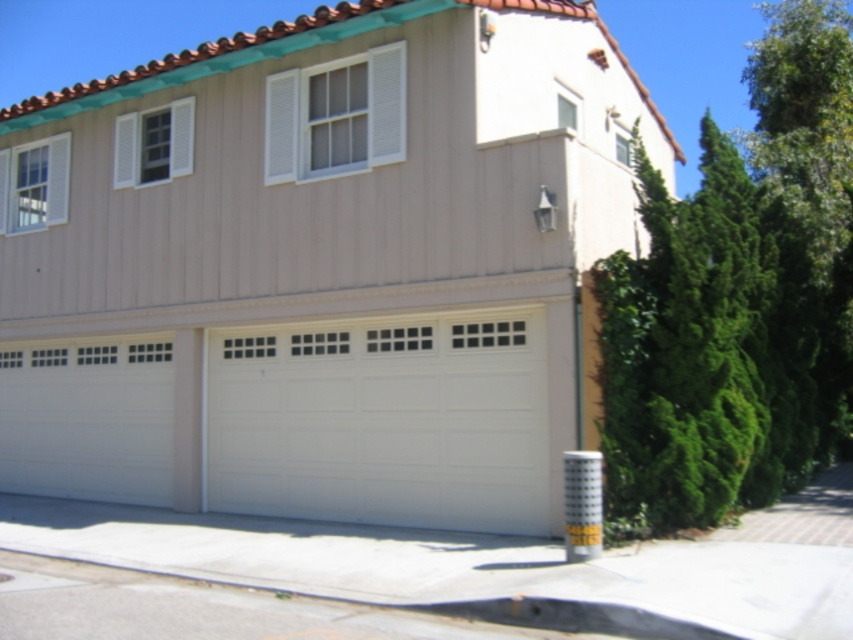
Who is more forward, (776,490) or (270,387)?

Point (776,490)

Between green leafy tree at right and white painted wood garage door at center, which one has less height?

Standing shorter between the two is white painted wood garage door at center.

Who is more forward, (662, 321) or (265, 474)?

Point (662, 321)

What are the coordinates of `green leafy tree at right` in the screenshot? It's located at (738, 300).

Who is positioned more to the left, white smooth garage door at center or green leafy tree at right?

white smooth garage door at center

Between white smooth garage door at center and green leafy tree at right, which one is positioned lower?

white smooth garage door at center is lower down.

Is point (50, 381) positioned before point (758, 48)?

Yes.

The height and width of the screenshot is (640, 853). Identify the location of white smooth garage door at center. (321, 266).

How distant is white smooth garage door at center from white painted wood garage door at center?

A distance of 1.28 meters exists between white smooth garage door at center and white painted wood garage door at center.

Consider the image. Is white smooth garage door at center below white painted wood garage door at center?

Incorrect, white smooth garage door at center is not positioned below white painted wood garage door at center.

Between point (258, 424) and point (462, 376), which one is positioned in front?

Point (462, 376)

The width and height of the screenshot is (853, 640). In order to click on white smooth garage door at center in this screenshot , I will do `click(321, 266)`.